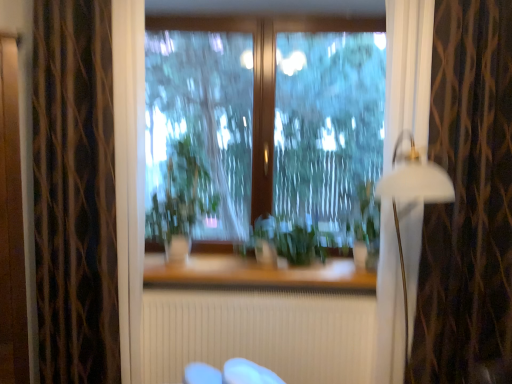
This screenshot has width=512, height=384. Identify the location of free spot above white textured radiator at center (from a real-world perspective). (258, 289).